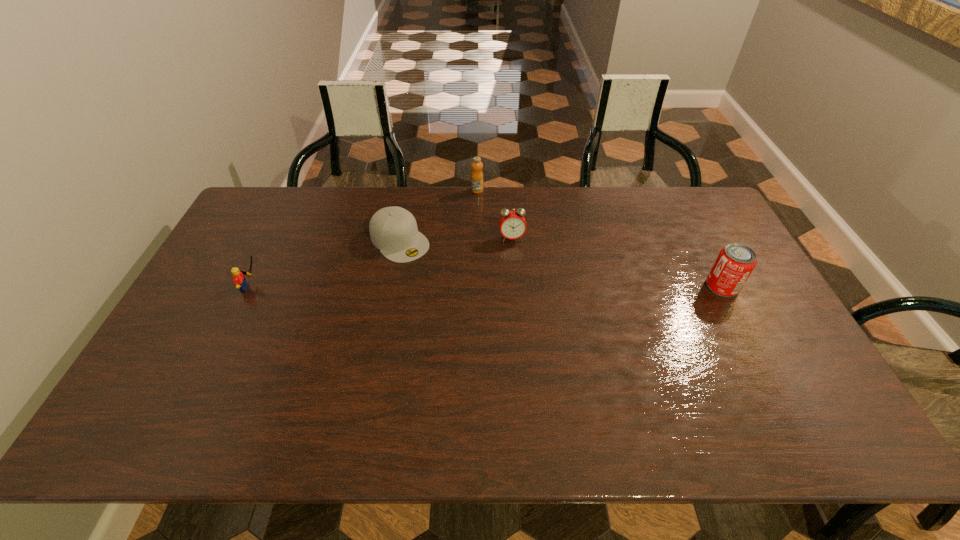
Image resolution: width=960 pixels, height=540 pixels. Identify the location of the leftmost object. (239, 280).

At what (x,y) coordinates should I click in order to perform the action: click on the rightmost object. Please return your answer as a coordinate pair (x, y). Image resolution: width=960 pixels, height=540 pixels. Looking at the image, I should click on (735, 262).

Locate an element on the screen. The width and height of the screenshot is (960, 540). cap is located at coordinates (393, 230).

This screenshot has width=960, height=540. Identify the location of the shortest object. (393, 230).

Where is `alarm clock`? This screenshot has width=960, height=540. alarm clock is located at coordinates (512, 224).

Where is `the farthest object`? This screenshot has height=540, width=960. the farthest object is located at coordinates (477, 175).

At what (x,y) coordinates should I click in order to perform the action: click on orange juice. Please return your answer as a coordinate pair (x, y). The image size is (960, 540). Looking at the image, I should click on (477, 175).

Image resolution: width=960 pixels, height=540 pixels. I want to click on vacant space located on the front-facing side of the leftmost object, so click(294, 288).

Identify the location of free region located on the right of the can. (758, 286).

Image resolution: width=960 pixels, height=540 pixels. I want to click on blank space located on the front-facing side of the shortest object, so [x=447, y=289].